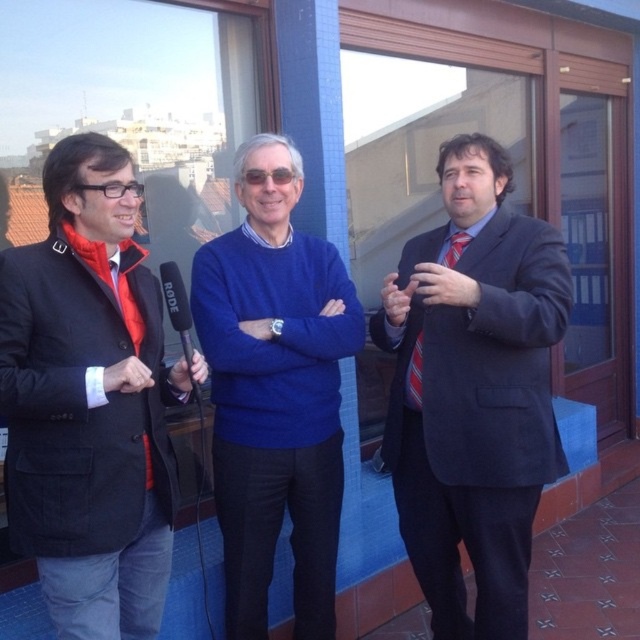
Question: Considering the relative positions of matte black suit at center and red satin tie at left in the image provided, where is matte black suit at center located with respect to red satin tie at left?

Choices:
 (A) right
 (B) left

Answer: (A)

Question: Among these points, which one is farthest from the camera?

Choices:
 (A) (148, 444)
 (B) (486, 465)
 (C) (115, 305)
 (D) (160, 269)

Answer: (B)

Question: Among these points, which one is nearest to the camera?

Choices:
 (A) (33, 516)
 (B) (106, 282)
 (C) (180, 300)

Answer: (A)

Question: Is black plastic microphone at center thinner than striped fabric tie at right?

Choices:
 (A) yes
 (B) no

Answer: (B)

Question: Does matte black blazer at left appear on the left side of black plastic microphone at center?

Choices:
 (A) yes
 (B) no

Answer: (A)

Question: Which of these objects is positioned farthest from the matte black blazer at left?

Choices:
 (A) striped fabric tie at right
 (B) matte black suit at center

Answer: (A)